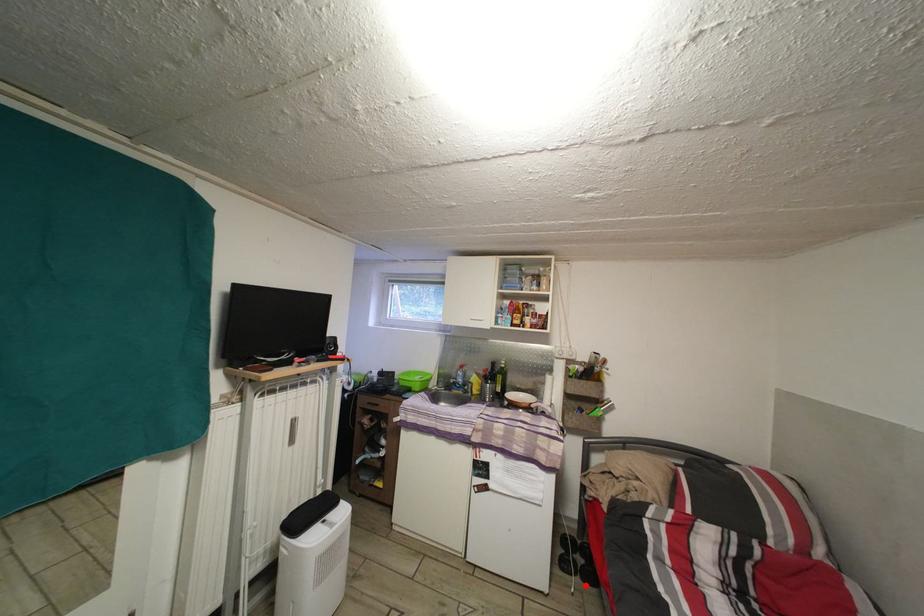
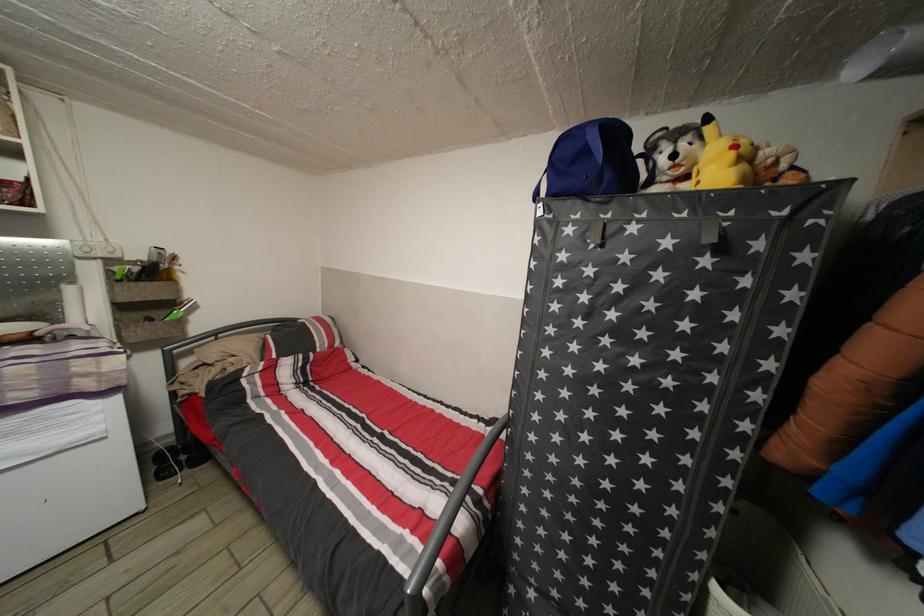
Find the pixel in the second image that matches the highlighted location in the first image.

(192, 477)